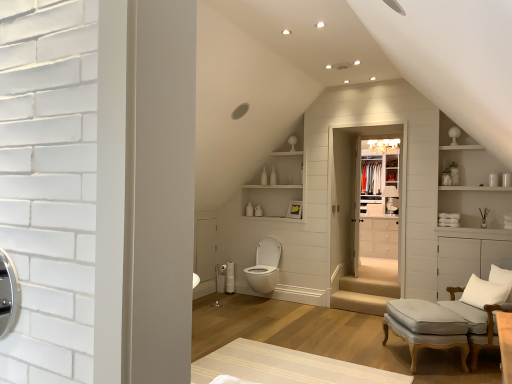
Question: From the image's perspective, is light gray fabric stool at lower right under white soft cushion at lower right?

Choices:
 (A) yes
 (B) no

Answer: (A)

Question: Does light gray fabric stool at lower right have a lesser height compared to white soft cushion at lower right?

Choices:
 (A) no
 (B) yes

Answer: (A)

Question: Is light gray fabric stool at lower right further to camera compared to white soft cushion at lower right?

Choices:
 (A) yes
 (B) no

Answer: (B)

Question: Is light gray fabric stool at lower right facing towards white soft cushion at lower right?

Choices:
 (A) yes
 (B) no

Answer: (B)

Question: Can you confirm if light gray fabric stool at lower right is taller than white soft cushion at lower right?

Choices:
 (A) no
 (B) yes

Answer: (B)

Question: Visually, is white glossy cabinet at upper right positioned to the left or to the right of beige striped rug at center?

Choices:
 (A) right
 (B) left

Answer: (A)

Question: Considering the positions of white glossy cabinet at upper right and beige striped rug at center in the image, is white glossy cabinet at upper right bigger or smaller than beige striped rug at center?

Choices:
 (A) small
 (B) big

Answer: (B)

Question: Considering the positions of white glossy cabinet at upper right and beige striped rug at center in the image, is white glossy cabinet at upper right taller or shorter than beige striped rug at center?

Choices:
 (A) tall
 (B) short

Answer: (A)

Question: In the image, is white glossy cabinet at upper right positioned in front of or behind beige striped rug at center?

Choices:
 (A) front
 (B) behind

Answer: (B)

Question: From the image's perspective, is white glossy toilet at center positioned above or below beige carpeted stairs at lower center?

Choices:
 (A) above
 (B) below

Answer: (A)

Question: Is white glossy toilet at center inside or outside of beige carpeted stairs at lower center?

Choices:
 (A) outside
 (B) inside

Answer: (A)

Question: Considering the relative positions of white glossy toilet at center and beige carpeted stairs at lower center in the image provided, is white glossy toilet at center to the left or to the right of beige carpeted stairs at lower center?

Choices:
 (A) left
 (B) right

Answer: (A)

Question: From a real-world perspective, is white glossy toilet at center positioned above or below beige carpeted stairs at lower center?

Choices:
 (A) below
 (B) above

Answer: (B)

Question: Is point (390, 206) positioned closer to the camera than point (361, 160)?

Choices:
 (A) farther
 (B) closer

Answer: (B)

Question: Is matte white lampshade at center spatially inside clear glass closet door at center, or outside of it?

Choices:
 (A) inside
 (B) outside

Answer: (B)